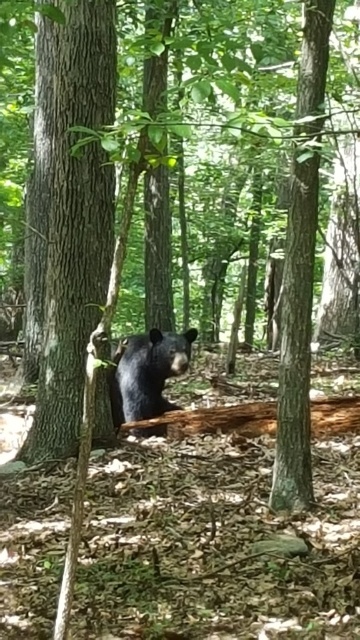
Based on the photo, is smooth brown tree trunk at left to the right of black furry bear at center from the viewer's perspective?

No, smooth brown tree trunk at left is not to the right of black furry bear at center.

Which is below, smooth brown tree trunk at left or black furry bear at center?

black furry bear at center is below.

I want to click on smooth brown tree trunk at left, so click(x=75, y=225).

Is point (141, 362) positioned after point (268, 406)?

Yes, point (141, 362) is behind point (268, 406).

Does black furry bear at center have a lesser height compared to brown rough log at center?

Incorrect, black furry bear at center's height does not fall short of brown rough log at center's.

Does point (119, 381) come closer to viewer compared to point (311, 422)?

No, (119, 381) is behind (311, 422).

Where is `black furry bear at center`? The width and height of the screenshot is (360, 640). black furry bear at center is located at coordinates (146, 372).

Is smooth brown tree trunk at left to the left of brown rough log at center from the viewer's perspective?

Indeed, smooth brown tree trunk at left is positioned on the left side of brown rough log at center.

Where is `smooth brown tree trunk at left`? The width and height of the screenshot is (360, 640). smooth brown tree trunk at left is located at coordinates (75, 225).